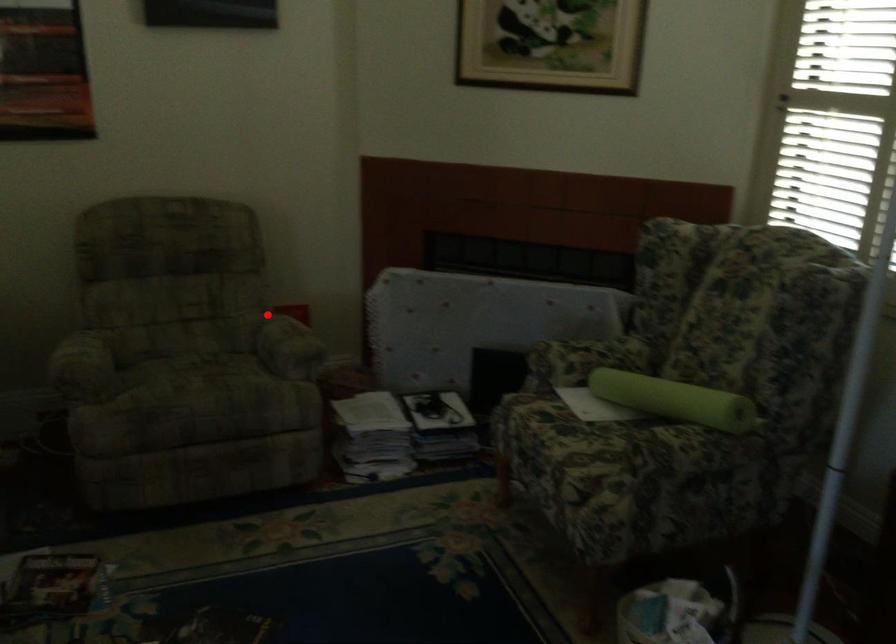
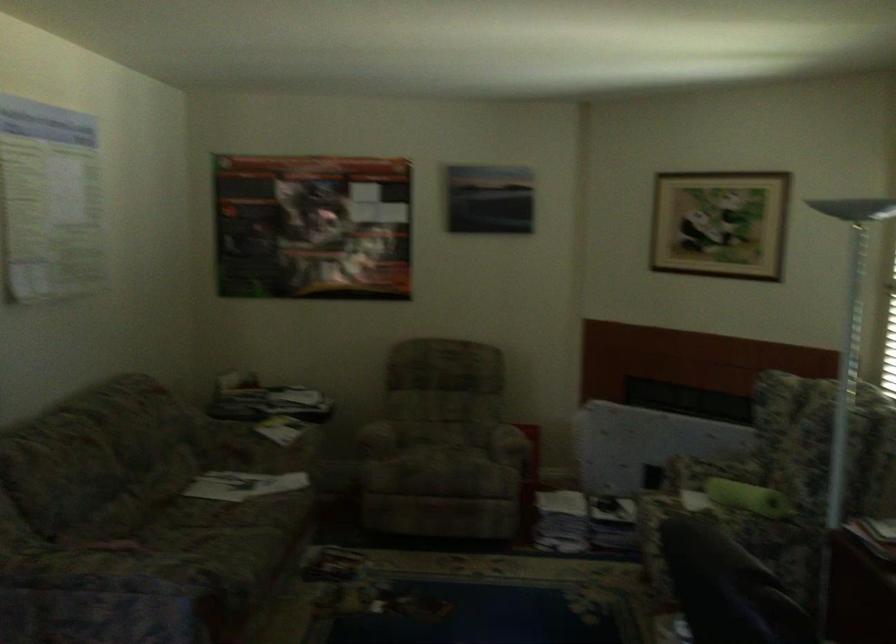
Question: I am providing you with two images of the same scene from different viewpoints. Given a red point in image1, look at the same physical point in image2. Is it:

Choices:
 (A) Closer to the viewpoint
 (B) Farther from the viewpoint

Answer: (B)